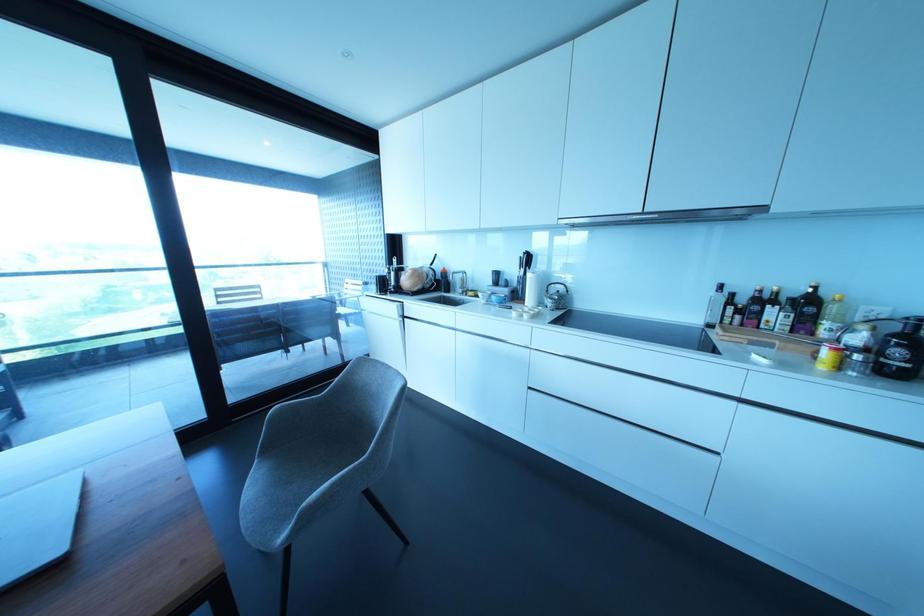
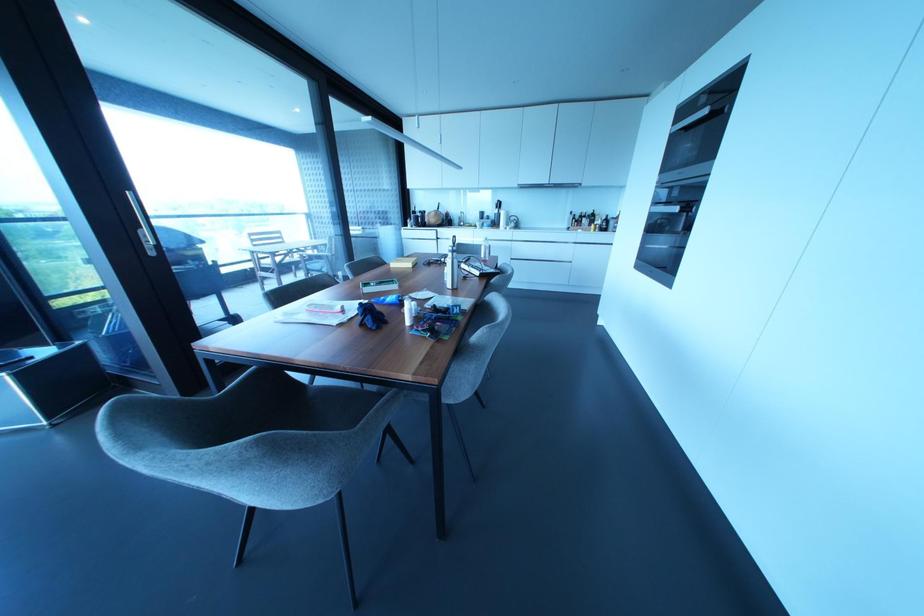
Which direction would the cameraman need to move to produce the second image?

The cameraman moved toward left, backward.